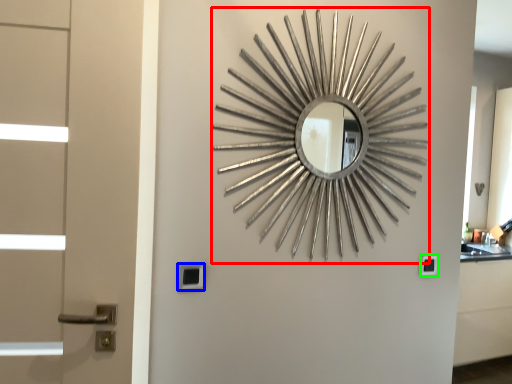
Question: Which is nearer to the design (highlighted by a red box)? lock (highlighted by a blue box) or lock (highlighted by a green box).

Choices:
 (A) lock
 (B) lock

Answer: (B)